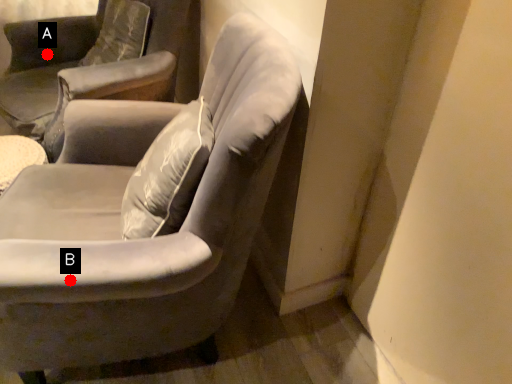
Question: Two points are circled on the image, labeled by A and B beside each circle. Which point is further to the camera?

Choices:
 (A) A is further
 (B) B is further

Answer: (A)